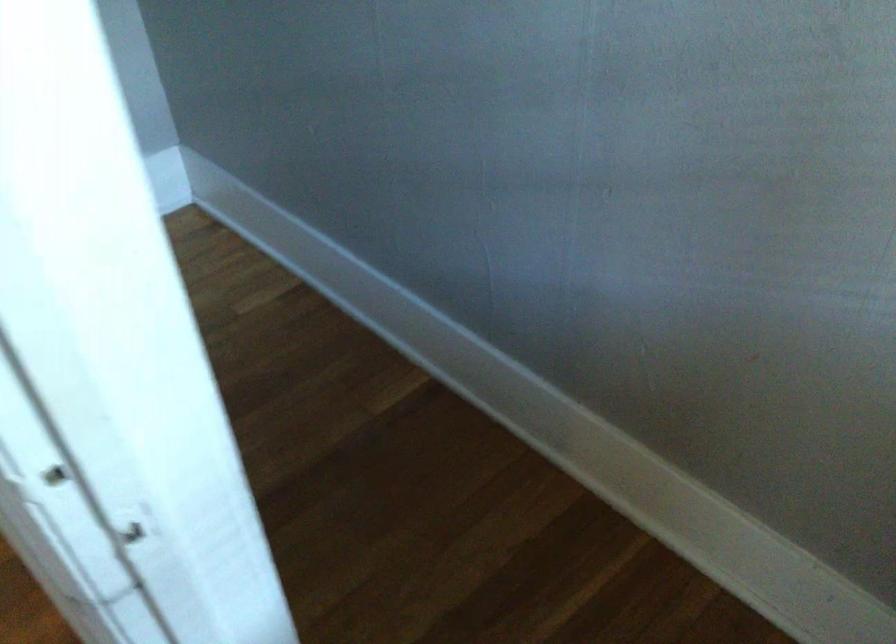
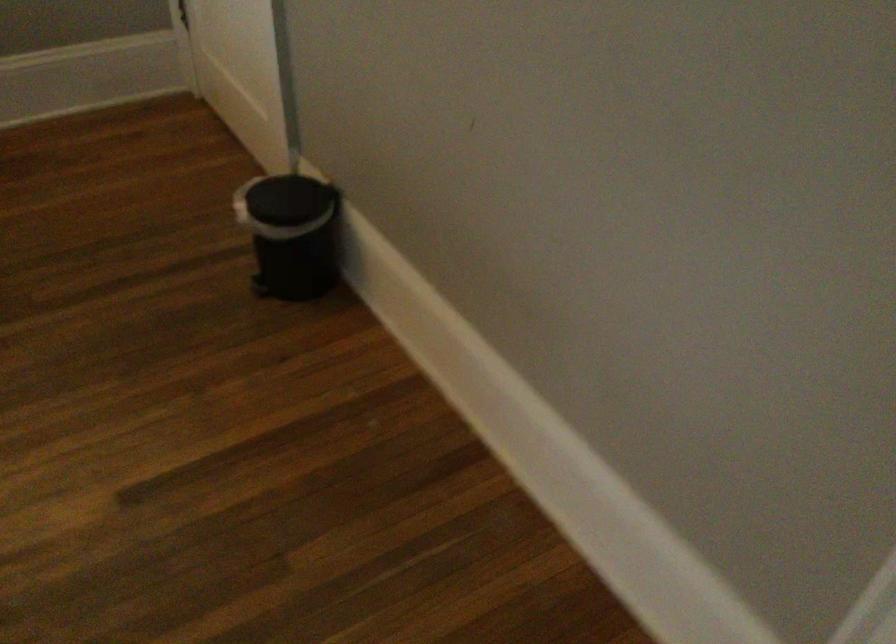
Question: How did the camera likely rotate?

Choices:
 (A) Left
 (B) Right
 (C) Up
 (D) Down

Answer: (A)